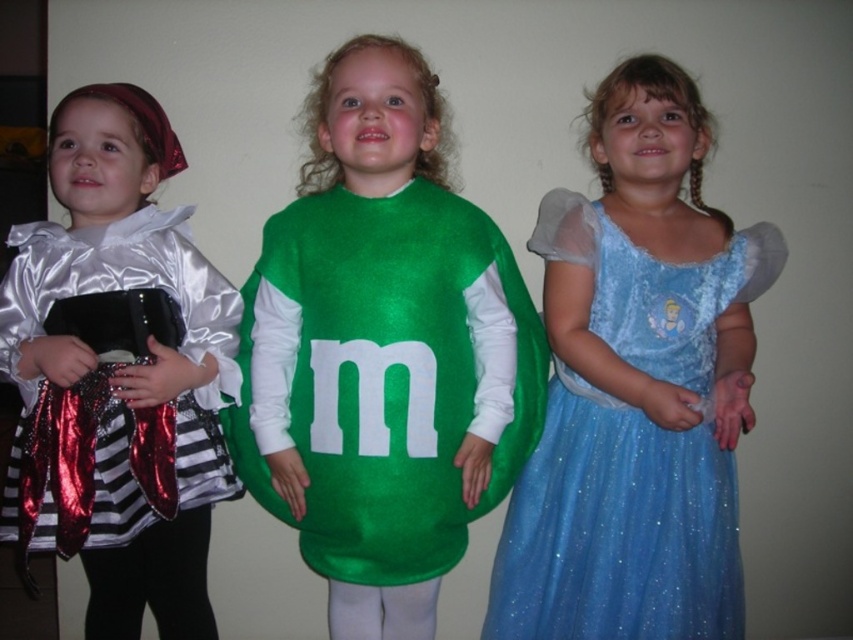
Question: Which of the following is the closest to the observer?

Choices:
 (A) (361, 496)
 (B) (699, 266)

Answer: (A)

Question: Is green shiny candy at center above shiny silver dress at left?

Choices:
 (A) yes
 (B) no

Answer: (A)

Question: Which object is closer to the camera taking this photo?

Choices:
 (A) green shiny candy at center
 (B) shiny silver dress at left

Answer: (A)

Question: Does green shiny candy at center lie in front of shiny silver dress at left?

Choices:
 (A) no
 (B) yes

Answer: (B)

Question: Which of the following is the farthest from the observer?

Choices:
 (A) shiny silver dress at left
 (B) green shiny candy at center

Answer: (A)

Question: Does green shiny candy at center lie in front of shiny silver dress at left?

Choices:
 (A) yes
 (B) no

Answer: (A)